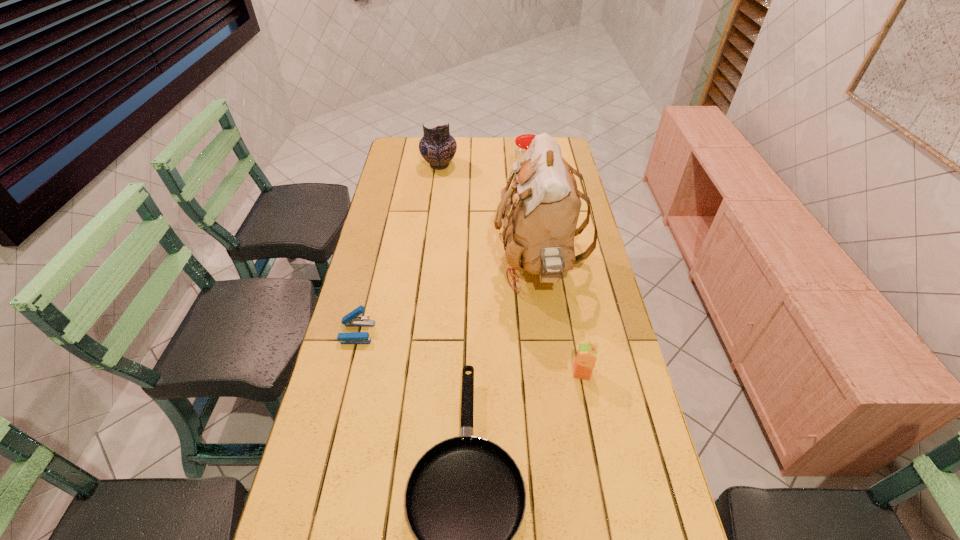
At what (x,y) coordinates should I click in order to perform the action: click on free space located 0.370m on the front of the pottery. Please return your answer as a coordinate pair (x, y). Image resolution: width=960 pixels, height=540 pixels. Looking at the image, I should click on (431, 230).

Image resolution: width=960 pixels, height=540 pixels. What are the coordinates of `vacant space located on the front of the third tallest object` in the screenshot? It's located at (535, 240).

Find the location of a particular element. The width and height of the screenshot is (960, 540). free region located on the back of the orange juice is located at coordinates (571, 314).

Locate an element on the screen. vacant point located 0.380m on the back of the stapler is located at coordinates (380, 239).

You are a GUI agent. You are given a task and a screenshot of the screen. Output one action in this format:
    pyautogui.click(x=<x>, y=<y>)
    Task: Click on the object present at the far edge
    
    Given the screenshot: What is the action you would take?
    pyautogui.click(x=437, y=146)

Find the location of `pottery situated at the left edge`. pottery situated at the left edge is located at coordinates (437, 146).

Locate an element on the screen. The width and height of the screenshot is (960, 540). stapler situated at the left edge is located at coordinates (351, 319).

Identify the location of backpack located in the right edge section of the desktop. This screenshot has width=960, height=540. (539, 213).

The height and width of the screenshot is (540, 960). Find the location of `jar positioned at the right edge`. jar positioned at the right edge is located at coordinates (523, 142).

At what (x,y) coordinates should I click in order to perform the action: click on orange juice located at the right edge. Please return your answer as a coordinate pair (x, y). Looking at the image, I should click on (586, 357).